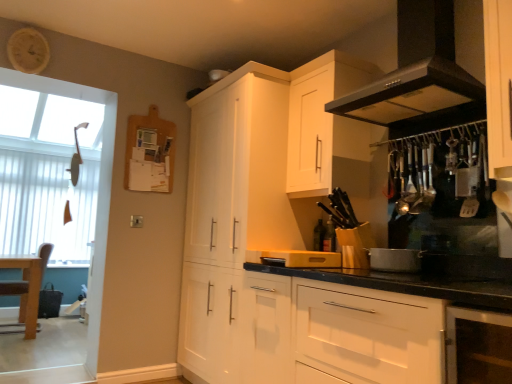
Question: From a real-world perspective, does white vertical blinds at left sit lower than black matte exhaust hood at upper right?

Choices:
 (A) no
 (B) yes

Answer: (B)

Question: Does white vertical blinds at left have a smaller size compared to black matte exhaust hood at upper right?

Choices:
 (A) yes
 (B) no

Answer: (A)

Question: From the image's perspective, does white vertical blinds at left appear lower than black matte exhaust hood at upper right?

Choices:
 (A) no
 (B) yes

Answer: (B)

Question: Is white vertical blinds at left completely or partially outside of black matte exhaust hood at upper right?

Choices:
 (A) no
 (B) yes

Answer: (B)

Question: Is white vertical blinds at left looking in the opposite direction of black matte exhaust hood at upper right?

Choices:
 (A) no
 (B) yes

Answer: (A)

Question: Is white vertical blinds at left further to the viewer compared to black matte exhaust hood at upper right?

Choices:
 (A) no
 (B) yes

Answer: (B)

Question: Considering the relative sizes of white matte cabinet at lower center, the first cabinetry when ordered from front to back, and black matte exhaust hood at upper right in the image provided, is white matte cabinet at lower center, the first cabinetry when ordered from front to back, shorter than black matte exhaust hood at upper right?

Choices:
 (A) no
 (B) yes

Answer: (A)

Question: Could you tell me if white matte cabinet at lower center, the first cabinetry when ordered from front to back, is facing black matte exhaust hood at upper right?

Choices:
 (A) yes
 (B) no

Answer: (B)

Question: From the image's perspective, would you say white matte cabinet at lower center, positioned as the 3th cabinetry in back-to-front order, is shown under black matte exhaust hood at upper right?

Choices:
 (A) yes
 (B) no

Answer: (A)

Question: Does white matte cabinet at lower center, the first cabinetry when ordered from front to back, lie behind black matte exhaust hood at upper right?

Choices:
 (A) yes
 (B) no

Answer: (B)

Question: Considering the relative sizes of white matte cabinet at lower center, positioned as the 3th cabinetry in back-to-front order, and black matte exhaust hood at upper right in the image provided, is white matte cabinet at lower center, positioned as the 3th cabinetry in back-to-front order, wider than black matte exhaust hood at upper right?

Choices:
 (A) no
 (B) yes

Answer: (B)

Question: Can you confirm if white matte cabinet at lower center, the first cabinetry when ordered from front to back, is taller than black matte exhaust hood at upper right?

Choices:
 (A) no
 (B) yes

Answer: (B)

Question: From a real-world perspective, is silver metallic pot at center, the 2th appliance in the left-to-right sequence, on black matte exhaust hood at upper right?

Choices:
 (A) no
 (B) yes

Answer: (A)